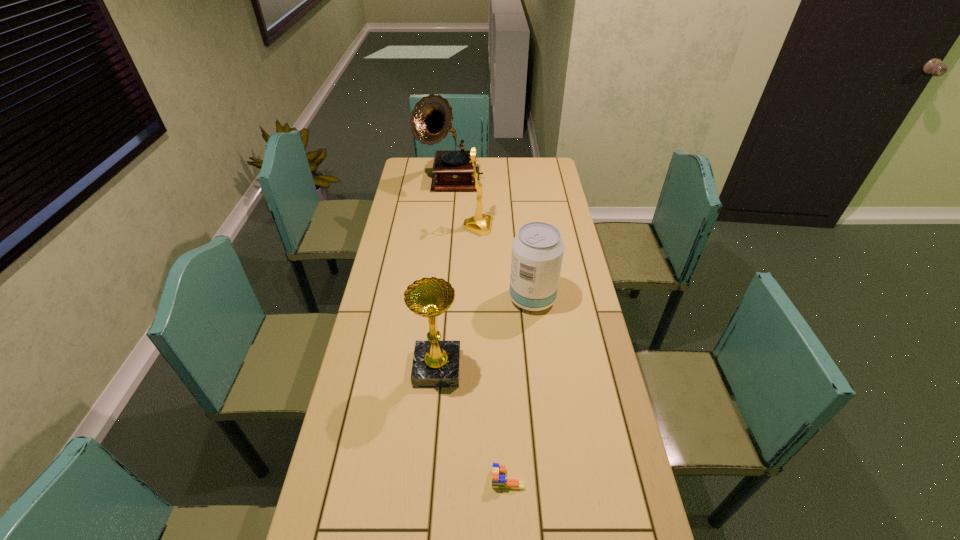
Locate an element on the screen. vacant space that satisfies the following two spatial constraints: 1. on the horn of the alcohol; 2. on the left side of the tallest object is located at coordinates (439, 299).

Locate an element on the screen. Image resolution: width=960 pixels, height=540 pixels. vacant position in the image that satisfies the following two spatial constraints: 1. on the horn of the nearest object; 2. on the left side of the record player is located at coordinates (422, 479).

I want to click on vacant point that satisfies the following two spatial constraints: 1. on the horn of the tallest object; 2. on the left side of the shortest object, so click(422, 479).